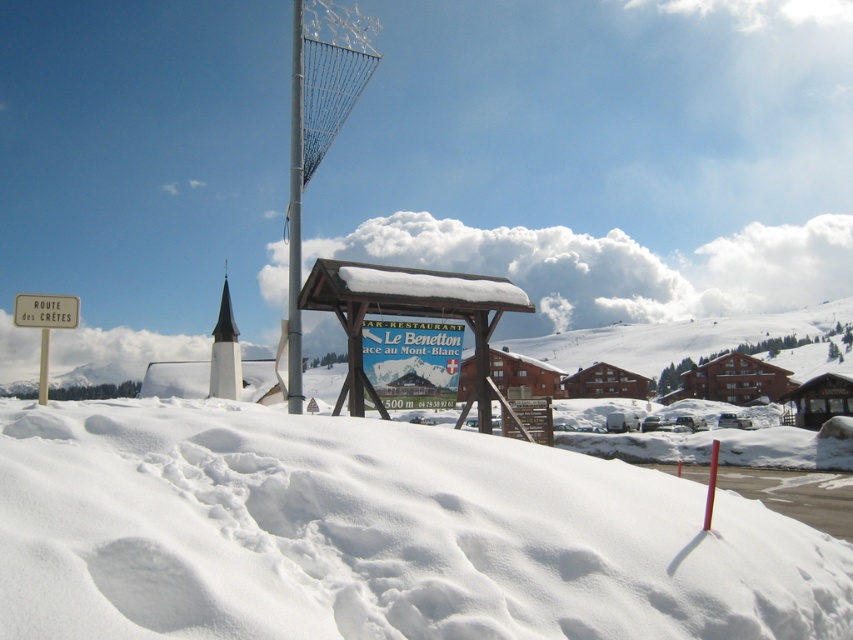
Question: Where is white wooden sign at left located in relation to white plastic pole at upper center in the image?

Choices:
 (A) above
 (B) below

Answer: (A)

Question: Does wooden signboard at center have a smaller size compared to white plastic pole at upper center?

Choices:
 (A) yes
 (B) no

Answer: (A)

Question: Is white wooden sign at left further to camera compared to white plastic pole at upper center?

Choices:
 (A) no
 (B) yes

Answer: (A)

Question: Which of the following is the closest to the observer?

Choices:
 (A) (292, 392)
 (B) (456, 292)
 (C) (41, 301)
 (D) (57, 317)

Answer: (C)

Question: Which object appears farthest from the camera in this image?

Choices:
 (A) wooden signboard at center
 (B) white powdery snow at lower center
 (C) metallic wire at center

Answer: (C)

Question: Among these objects, which one is farthest from the camera?

Choices:
 (A) white powdery snow at lower center
 (B) white wooden sign at upper left
 (C) metallic wire at center
 (D) wooden signboard at center

Answer: (C)